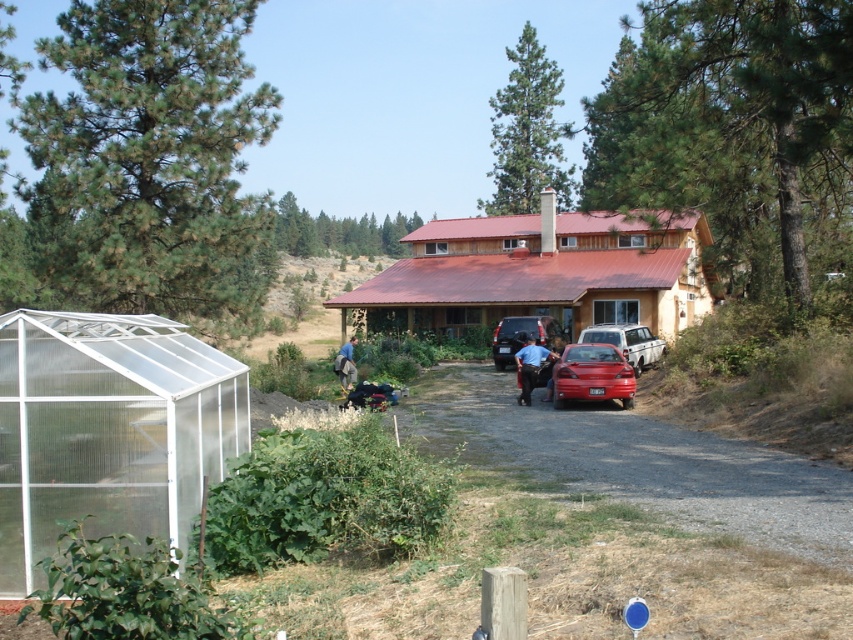
Question: Is metallic silver sedan at center below blue fabric shirt at center?

Choices:
 (A) yes
 (B) no

Answer: (B)

Question: Estimate the real-world distances between objects in this image. Which object is closer to the green matte pine at upper center?

Choices:
 (A) green textured pine at left
 (B) green rough bark tree at upper center
 (C) blue jeans at center

Answer: (B)

Question: Considering the relative positions of metallic silver sedan at center and blue fabric shirt at center in the image provided, where is metallic silver sedan at center located with respect to blue fabric shirt at center?

Choices:
 (A) right
 (B) left

Answer: (A)

Question: Which of the following is the closest to the observer?

Choices:
 (A) (318, 216)
 (B) (601, 353)
 (C) (540, 324)

Answer: (B)

Question: Estimate the real-world distances between objects in this image. Which object is closer to the shiny red sedan at center?

Choices:
 (A) metallic silver sedan at center
 (B) green rough bark tree at upper center
 (C) red gravel driveway at center

Answer: (C)

Question: Is red gravel driveway at center bigger than blue jeans at center?

Choices:
 (A) no
 (B) yes

Answer: (A)